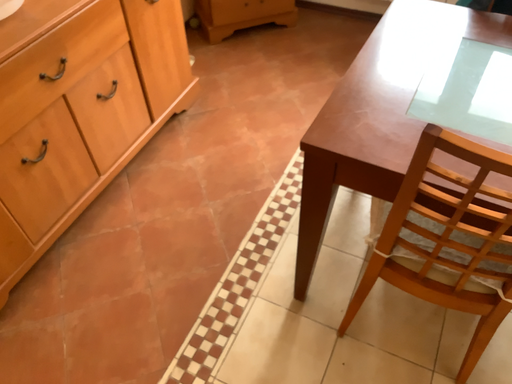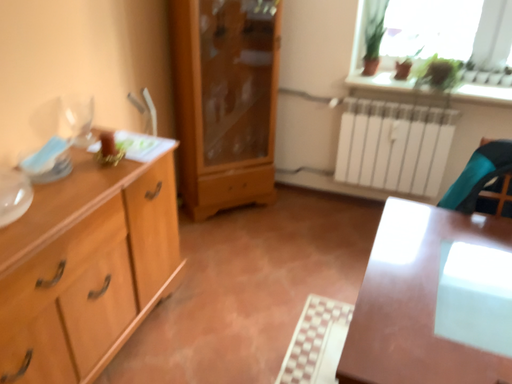
Question: Which way did the camera rotate in the video?

Choices:
 (A) rotated downward
 (B) rotated upward

Answer: (B)